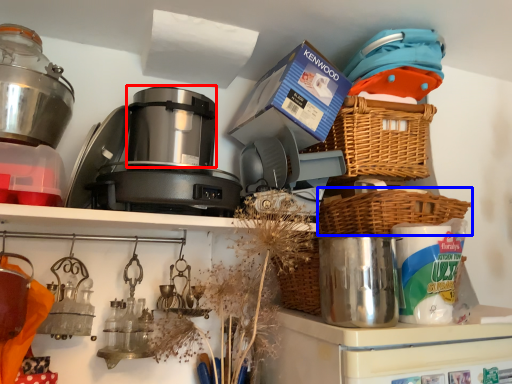
Question: Which of the following is the closest to the observer, appliance (highlighted by a red box) or basket (highlighted by a blue box)?

Choices:
 (A) appliance
 (B) basket

Answer: (B)